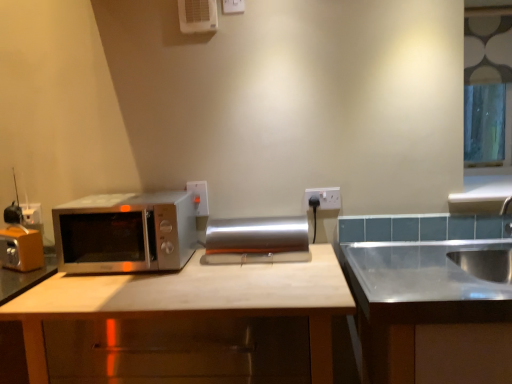
Find the location of a particular element. This screenshot has height=384, width=512. vacant area that lies between silver metallic paper towel holder at center and satin silver microwave at left is located at coordinates (228, 264).